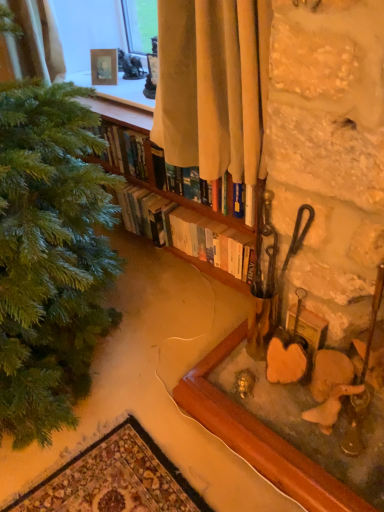
Where is `wooden frame at upper center, the first picture frame positioned from the back`? This screenshot has width=384, height=512. wooden frame at upper center, the first picture frame positioned from the back is located at coordinates (104, 66).

The image size is (384, 512). I want to click on beige fabric curtain at upper center, so click(213, 85).

Considering the sizes of objects beige fabric curtain at upper center and hardcover books at center in the image provided, who is bigger, beige fabric curtain at upper center or hardcover books at center?

beige fabric curtain at upper center is bigger.

How far apart are beige fabric curtain at upper center and hardcover books at center?

A distance of 15.64 inches exists between beige fabric curtain at upper center and hardcover books at center.

Is beige fabric curtain at upper center closer to the viewer compared to hardcover books at center?

That is True.

Considering the sizes of beige fabric curtain at upper center and hardcover books at center in the image, is beige fabric curtain at upper center wider or thinner than hardcover books at center?

beige fabric curtain at upper center is wider than hardcover books at center.

Consider the image. Can you confirm if wooden frame at upper center, the 1th picture frame positioned from the left, is shorter than hardcover books at center?

Correct, wooden frame at upper center, the 1th picture frame positioned from the left, is not as tall as hardcover books at center.

Is wooden frame at upper center, the second picture frame in the right-to-left sequence, situated inside hardcover books at center or outside?

wooden frame at upper center, the second picture frame in the right-to-left sequence, is not inside hardcover books at center, it's outside.

What's the angular difference between wooden frame at upper center, the first picture frame from the top, and hardcover books at center's facing directions?

The angle between the facing direction of wooden frame at upper center, the first picture frame from the top, and the facing direction of hardcover books at center is 28.8 degrees.

In the scene shown: Considering the relative sizes of wooden frame at upper center, the second picture frame in the right-to-left sequence, and hardcover books at center in the image provided, is wooden frame at upper center, the second picture frame in the right-to-left sequence, smaller than hardcover books at center?

Correct, wooden frame at upper center, the second picture frame in the right-to-left sequence, occupies less space than hardcover books at center.

Consider the image. Does hardcover books at center appear on the left side of wooden frame at upper center, marked as the second picture frame in a front-to-back arrangement?

No, hardcover books at center is not to the left of wooden frame at upper center, marked as the second picture frame in a front-to-back arrangement.

How much distance is there between hardcover books at center and wooden frame at upper center, which is counted as the 2th picture frame, starting from the bottom?

hardcover books at center is 52.07 centimeters away from wooden frame at upper center, which is counted as the 2th picture frame, starting from the bottom.

Is hardcover books at center positioned beyond the bounds of wooden frame at upper center, the first picture frame from the top?

Yes, hardcover books at center is outside of wooden frame at upper center, the first picture frame from the top.

Can you confirm if hardcover books at center is wider than wooden frame at upper center, marked as the second picture frame in a front-to-back arrangement?

Yes, hardcover books at center is wider than wooden frame at upper center, marked as the second picture frame in a front-to-back arrangement.

Is wooden frame at upper center, the 1th picture frame positioned from the left, surrounding wooden picture frame at lower right, acting as the 1th picture frame starting from the bottom?

Definitely not — wooden picture frame at lower right, acting as the 1th picture frame starting from the bottom, is not inside wooden frame at upper center, the 1th picture frame positioned from the left.

Who is more distant, wooden frame at upper center, the first picture frame from the top, or wooden picture frame at lower right, which is the 2th picture frame in top-to-bottom order?

Positioned behind is wooden frame at upper center, the first picture frame from the top.

Are wooden frame at upper center, the 1th picture frame positioned from the left, and wooden picture frame at lower right, acting as the first picture frame starting from the front, making contact?

wooden frame at upper center, the 1th picture frame positioned from the left, is not next to wooden picture frame at lower right, acting as the first picture frame starting from the front, and they're not touching.

From the image's perspective, which is below, wooden frame at upper center, which is counted as the 2th picture frame, starting from the bottom, or wooden picture frame at lower right, which appears as the first picture frame when viewed from the right?

From the image's view, wooden picture frame at lower right, which appears as the first picture frame when viewed from the right, is below.

From their relative heights in the image, would you say hardcover books at center is taller or shorter than wooden picture frame at lower right, acting as the first picture frame starting from the front?

Clearly, hardcover books at center is taller compared to wooden picture frame at lower right, acting as the first picture frame starting from the front.

Could you tell me if hardcover books at center is turned towards wooden picture frame at lower right, acting as the 2th picture frame starting from the back?

No, hardcover books at center is not facing towards wooden picture frame at lower right, acting as the 2th picture frame starting from the back.

Would you say hardcover books at center is a long distance from wooden picture frame at lower right, which appears as the first picture frame when viewed from the right?

No, hardcover books at center is not far from wooden picture frame at lower right, which appears as the first picture frame when viewed from the right.

You are a GUI agent. You are given a task and a screenshot of the screen. Output one action in this format:
    pyautogui.click(x=<x>, y=<y>)
    Task: Click on the picture frame above the wooden picture frame at lower right, which is the 2th picture frame in top-to-bottom order (from a real-world perspective)
    Image resolution: width=384 pixels, height=512 pixels.
    Given the screenshot: What is the action you would take?
    pyautogui.click(x=104, y=66)

Can you see wooden picture frame at lower right, which is the 2th picture frame in top-to-bottom order, touching wooden frame at upper center, which is counted as the 2th picture frame, starting from the bottom?

There is a gap between wooden picture frame at lower right, which is the 2th picture frame in top-to-bottom order, and wooden frame at upper center, which is counted as the 2th picture frame, starting from the bottom.

Between wooden picture frame at lower right, which is the 2th picture frame in top-to-bottom order, and wooden frame at upper center, the second picture frame in the right-to-left sequence, which one is positioned in front?

wooden picture frame at lower right, which is the 2th picture frame in top-to-bottom order, is more forward.

Is wooden picture frame at lower right, acting as the 2th picture frame starting from the back, spatially inside wooden frame at upper center, marked as the second picture frame in a front-to-back arrangement, or outside of it?

wooden picture frame at lower right, acting as the 2th picture frame starting from the back, exists outside the volume of wooden frame at upper center, marked as the second picture frame in a front-to-back arrangement.

Is beige fabric curtain at upper center aimed at wooden picture frame at lower right, which appears as the first picture frame when viewed from the right?

No, beige fabric curtain at upper center is not aimed at wooden picture frame at lower right, which appears as the first picture frame when viewed from the right.

Looking at this image, which object is closer to the camera, beige fabric curtain at upper center or wooden picture frame at lower right, acting as the 2th picture frame starting from the back?

beige fabric curtain at upper center is closer to the camera.

Considering the relative sizes of beige fabric curtain at upper center and wooden picture frame at lower right, arranged as the 2th picture frame when viewed from the left, in the image provided, is beige fabric curtain at upper center smaller than wooden picture frame at lower right, arranged as the 2th picture frame when viewed from the left,?

Incorrect, beige fabric curtain at upper center is not smaller in size than wooden picture frame at lower right, arranged as the 2th picture frame when viewed from the left.

Identify the location of curtain lying on the left of wooden picture frame at lower right, which is the 2th picture frame in top-to-bottom order. (213, 85).

What are the coordinates of `curtain above the hardcover books at center (from a real-world perspective)` in the screenshot? It's located at (213, 85).

You are a GUI agent. You are given a task and a screenshot of the screen. Output one action in this format:
    pyautogui.click(x=<x>, y=<y>)
    Task: Click on the book in front of the wooden frame at upper center, the first picture frame from the top
    The image size is (384, 512).
    Given the screenshot: What is the action you would take?
    pyautogui.click(x=152, y=173)

Which object lies nearer to the anchor point wooden picture frame at lower right, which appears as the first picture frame when viewed from the right, hardcover books at center or beige fabric curtain at upper center?

The object closer to wooden picture frame at lower right, which appears as the first picture frame when viewed from the right, is hardcover books at center.

Considering their positions, is hardcover books at center positioned further to wooden picture frame at lower right, acting as the 1th picture frame starting from the bottom, than wooden frame at upper center, the first picture frame positioned from the back?

wooden frame at upper center, the first picture frame positioned from the back, lies further to wooden picture frame at lower right, acting as the 1th picture frame starting from the bottom, than the other object.

Based on the photo, based on their spatial positions, is wooden frame at upper center, marked as the second picture frame in a front-to-back arrangement, or hardcover books at center further from wooden picture frame at lower right, arranged as the 2th picture frame when viewed from the left?

wooden frame at upper center, marked as the second picture frame in a front-to-back arrangement, lies further to wooden picture frame at lower right, arranged as the 2th picture frame when viewed from the left, than the other object.

From the picture: Estimate the real-world distances between objects in this image. Which object is further from wooden frame at upper center, which is counted as the 2th picture frame, starting from the bottom, hardcover books at center or beige fabric curtain at upper center?

beige fabric curtain at upper center is further to wooden frame at upper center, which is counted as the 2th picture frame, starting from the bottom.

From the image, which object appears to be nearer to wooden frame at upper center, marked as the second picture frame in a front-to-back arrangement, wooden picture frame at lower right, which is the 2th picture frame in top-to-bottom order, or hardcover books at center?

hardcover books at center is positioned closer to the anchor wooden frame at upper center, marked as the second picture frame in a front-to-back arrangement.

Estimate the real-world distances between objects in this image. Which object is closer to beige fabric curtain at upper center, wooden frame at upper center, the second picture frame in the right-to-left sequence, or hardcover books at center?

Based on the image, hardcover books at center appears to be nearer to beige fabric curtain at upper center.

Which object lies nearer to the anchor point beige fabric curtain at upper center, wooden frame at upper center, which is counted as the 2th picture frame, starting from the bottom, or wooden picture frame at lower right, acting as the 1th picture frame starting from the bottom?

wooden picture frame at lower right, acting as the 1th picture frame starting from the bottom.

From the image, which object appears to be farther from hardcover books at center, beige fabric curtain at upper center or wooden frame at upper center, which is counted as the 2th picture frame, starting from the bottom?

wooden frame at upper center, which is counted as the 2th picture frame, starting from the bottom, lies further to hardcover books at center than the other object.

The height and width of the screenshot is (512, 384). Identify the location of book between wooden frame at upper center, the second picture frame in the right-to-left sequence, and wooden picture frame at lower right, which is the 2th picture frame in top-to-bottom order, vertically. coord(152,173).

Where is `book between beige fabric curtain at upper center and wooden frame at upper center, marked as the second picture frame in a front-to-back arrangement, along the z-axis`? book between beige fabric curtain at upper center and wooden frame at upper center, marked as the second picture frame in a front-to-back arrangement, along the z-axis is located at coordinates (152, 173).

Identify the location of book between beige fabric curtain at upper center and wooden picture frame at lower right, acting as the 1th picture frame starting from the bottom, in the up-down direction. Image resolution: width=384 pixels, height=512 pixels. (152, 173).

Where is `curtain between wooden frame at upper center, the first picture frame positioned from the back, and wooden picture frame at lower right, acting as the 1th picture frame starting from the bottom, from top to bottom`? The height and width of the screenshot is (512, 384). curtain between wooden frame at upper center, the first picture frame positioned from the back, and wooden picture frame at lower right, acting as the 1th picture frame starting from the bottom, from top to bottom is located at coordinates click(213, 85).